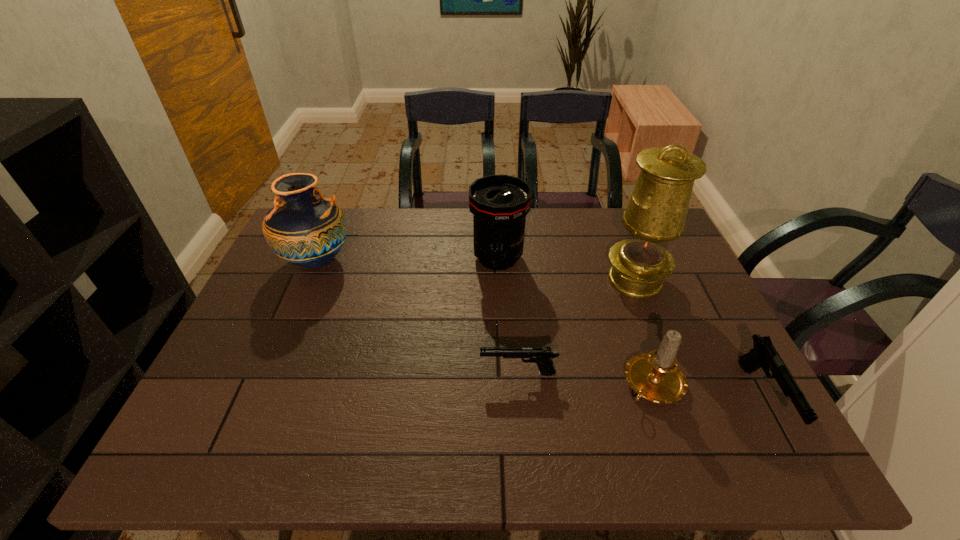
Find the location of a particular element. This screenshot has height=540, width=960. the shorter gun is located at coordinates (542, 356).

Where is `the left gun`? The width and height of the screenshot is (960, 540). the left gun is located at coordinates (542, 356).

I want to click on the taller gun, so click(x=764, y=354).

Where is `the rightmost object`? the rightmost object is located at coordinates (764, 354).

This screenshot has width=960, height=540. I want to click on telephoto lens, so tap(499, 203).

Identify the location of oil lamp. Image resolution: width=960 pixels, height=540 pixels. (655, 215).

Where is `pottery`? The width and height of the screenshot is (960, 540). pottery is located at coordinates (303, 228).

Locate an element on the screen. This screenshot has height=540, width=960. candle is located at coordinates (655, 376).

Locate an element on the screen. The width and height of the screenshot is (960, 540). free space located 0.360m at the aiming end of the left gun is located at coordinates (327, 373).

The image size is (960, 540). I want to click on vacant region located 0.190m at the aiming end of the left gun, so click(399, 373).